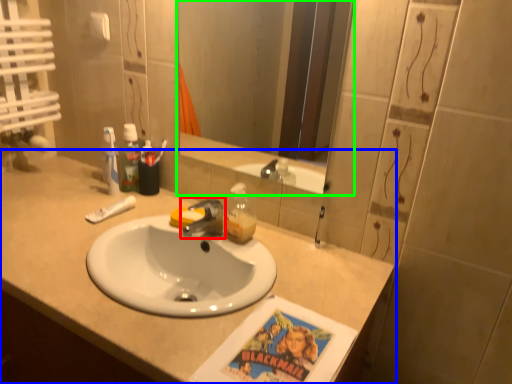
Question: Estimate the real-world distances between objects in this image. Which object is closer to tap (highlighted by a red box), countertop (highlighted by a blue box) or mirror (highlighted by a green box)?

Choices:
 (A) countertop
 (B) mirror

Answer: (A)